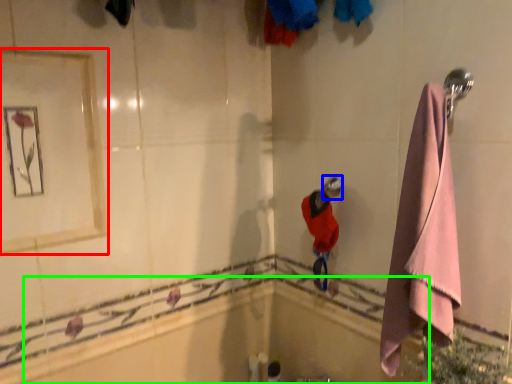
Question: Based on their relative distances, which object is farther from mirror (highlighted by a red box)? Choose from shower (highlighted by a blue box) and bath (highlighted by a green box).

Choices:
 (A) shower
 (B) bath

Answer: (A)